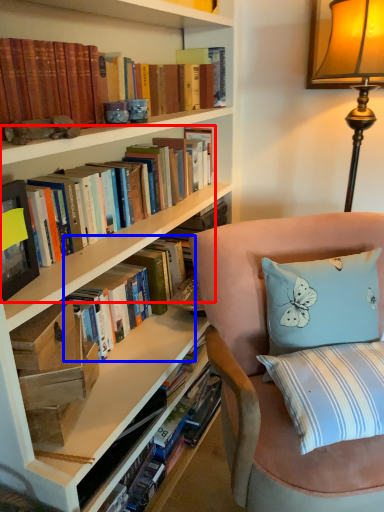
Question: Which point is closer to the camera, book (highlighted by a red box) or book (highlighted by a blue box)?

Choices:
 (A) book
 (B) book

Answer: (A)